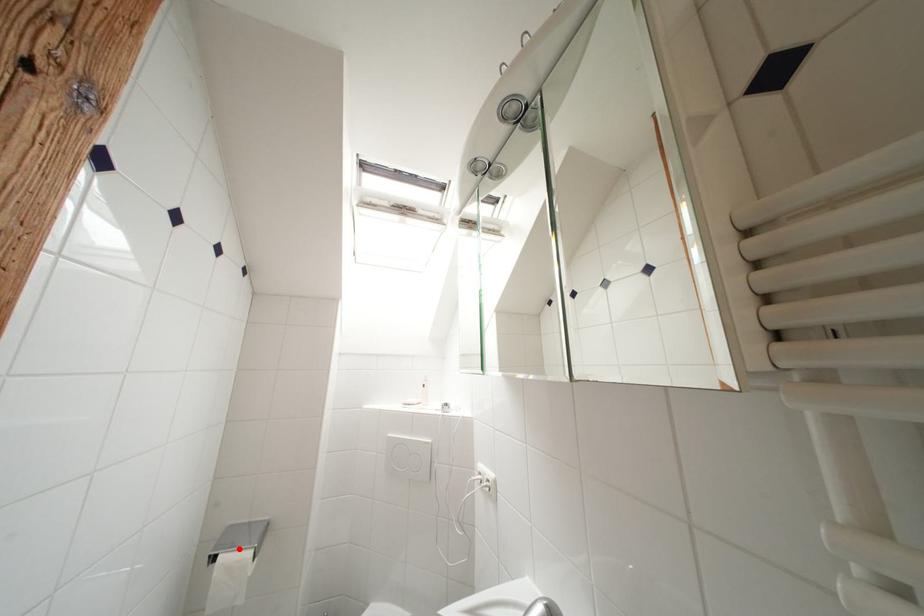
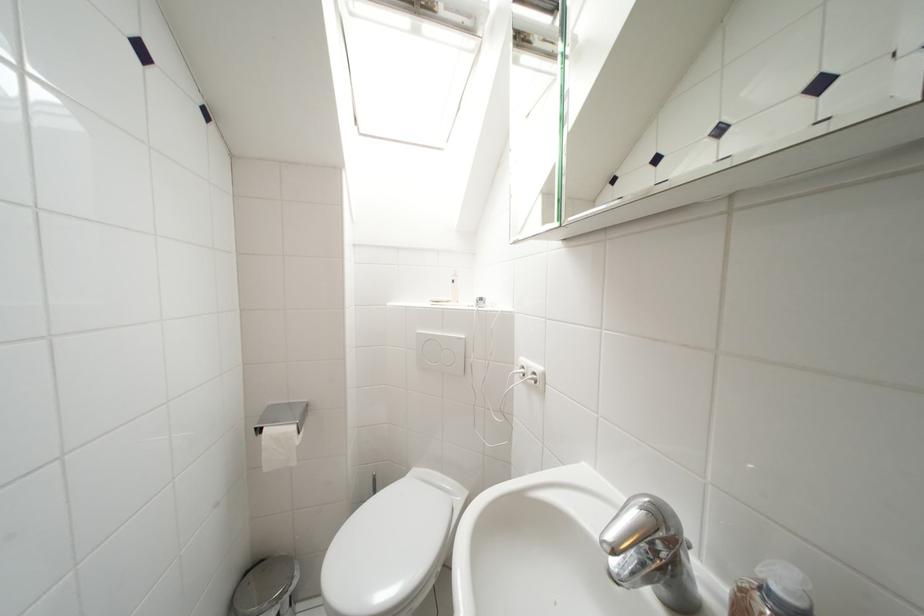
The point at the highlighted location is marked in the first image. Where is the corresponding point in the second image?

(283, 424)